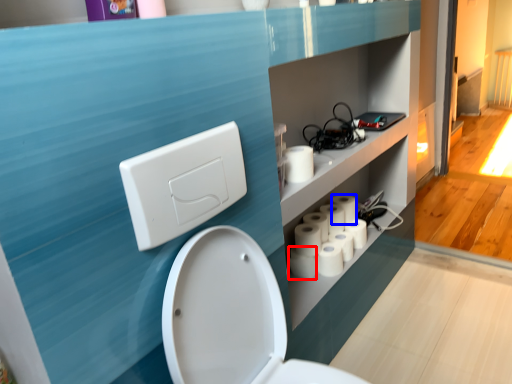
Question: Which of the following is the closest to the observer, toilet paper (highlighted by a red box) or toilet paper (highlighted by a blue box)?

Choices:
 (A) toilet paper
 (B) toilet paper

Answer: (A)